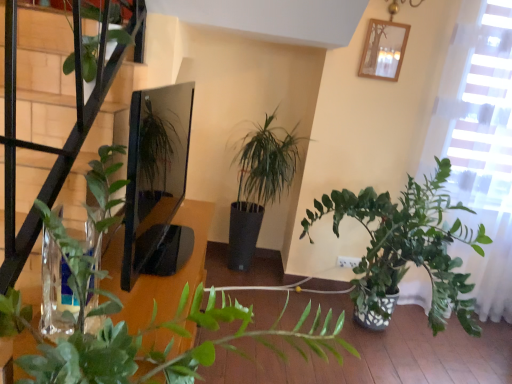
In order to face green leafy plant at upper left, should I rotate leftwards or rightwards?

You should look left and rotate roughly 21.155 degrees.

At what (x,y) coordinates should I click in order to perform the action: click on wooden picture frame at upper center. Please return your answer as a coordinate pair (x, y). Looking at the image, I should click on (383, 50).

How different are the orientations of wooden picture frame at upper center and green matte plant at center in degrees?

The angle between the facing direction of wooden picture frame at upper center and the facing direction of green matte plant at center is 90 degrees.

Relative to green matte plant at center, is wooden picture frame at upper center in front or behind?

wooden picture frame at upper center is behind green matte plant at center.

Is wooden picture frame at upper center facing away from green matte plant at center?

No, wooden picture frame at upper center is not facing away from green matte plant at center.

Which is in front, point (405, 44) or point (101, 294)?

Point (101, 294)

Between green leafy plant at upper left and wooden picture frame at upper center, which one has more height?

With more height is green leafy plant at upper left.

Based on the photo, considering the sizes of green leafy plant at upper left and wooden picture frame at upper center in the image, is green leafy plant at upper left wider or thinner than wooden picture frame at upper center?

In the image, green leafy plant at upper left appears to be wider than wooden picture frame at upper center.

Would you say green leafy plant at upper left is outside wooden picture frame at upper center?

Yes.

Is green leafy plant at upper left bigger than wooden picture frame at upper center?

Correct, green leafy plant at upper left is larger in size than wooden picture frame at upper center.

Who is smaller, wooden picture frame at upper center or green leafy plant at upper left?

wooden picture frame at upper center.

Considering the relative positions of wooden picture frame at upper center and green leafy plant at upper left in the image provided, is wooden picture frame at upper center to the right of green leafy plant at upper left from the viewer's perspective?

Correct, you'll find wooden picture frame at upper center to the right of green leafy plant at upper left.

Which is less distant, (386,61) or (81,56)?

Point (386,61) is farther from the camera than point (81,56).

In terms of width, does wooden picture frame at upper center look wider or thinner when compared to green leafy plant at upper left?

wooden picture frame at upper center is thinner than green leafy plant at upper left.

Which of these two, green matte plant at center or green leafy plant at upper left, stands taller?

green matte plant at center.

Is green matte plant at center in contact with green leafy plant at upper left?

No, green matte plant at center is not next to green leafy plant at upper left.

Is green leafy plant at upper left taller or shorter than green matte plant at center?

green leafy plant at upper left is shorter than green matte plant at center.

Which object is further away from the camera, green leafy plant at upper left or green matte plant at center?

green leafy plant at upper left.

Find the location of a particular element. This screenshot has height=384, width=512. houseplant in front of the green leafy plant at upper left is located at coordinates (141, 329).

Are green matte plant at center and wooden picture frame at upper center located far from each other?

Indeed, green matte plant at center is not near wooden picture frame at upper center.

Considering the sizes of objects green matte plant at center and wooden picture frame at upper center in the image provided, who is taller, green matte plant at center or wooden picture frame at upper center?

Standing taller between the two is green matte plant at center.

From the image's perspective, who appears lower, green matte plant at center or wooden picture frame at upper center?

green matte plant at center, from the image's perspective.

Does green matte plant at center have a larger size compared to wooden picture frame at upper center?

Correct, green matte plant at center is larger in size than wooden picture frame at upper center.

The width and height of the screenshot is (512, 384). Identify the location of picture frame above the green matte plant at center (from the image's perspective). (383, 50).

This screenshot has height=384, width=512. I want to click on vegetation located underneath the wooden picture frame at upper center (from a real-world perspective), so click(89, 57).

Based on their spatial positions, is green leafy plant at upper left or wooden picture frame at upper center closer to green matte plant at center?

The object closer to green matte plant at center is green leafy plant at upper left.

Considering their positions, is green matte plant at center positioned further to wooden picture frame at upper center than green leafy plant at upper left?

green matte plant at center.

From the image, which object appears to be farther from wooden picture frame at upper center, green leafy plant at upper left or green matte plant at center?

green matte plant at center lies further to wooden picture frame at upper center than the other object.

Looking at the image, which one is located closer to green leafy plant at upper left, wooden picture frame at upper center or green matte plant at center?

green matte plant at center.

Looking at the image, which one is located closer to green matte plant at center, wooden picture frame at upper center or green leafy plant at upper left?

green leafy plant at upper left is positioned closer to the anchor green matte plant at center.

Which object lies nearer to the anchor point green leafy plant at upper left, green matte plant at center or wooden picture frame at upper center?

The object closer to green leafy plant at upper left is green matte plant at center.

Locate an element on the screen. This screenshot has height=384, width=512. vegetation located between green matte plant at center and wooden picture frame at upper center in the depth direction is located at coordinates (89, 57).